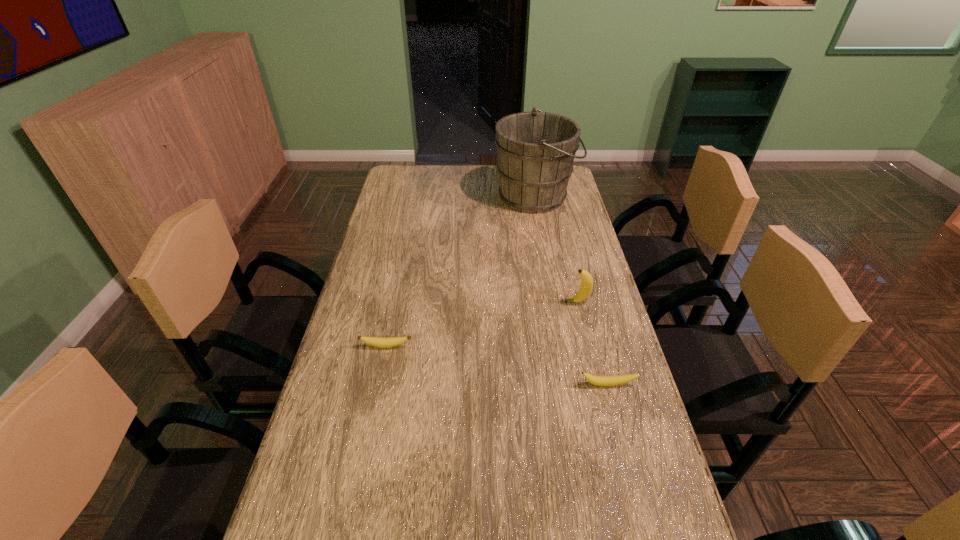
Where is `free space located from the stem of the farthest banana`? The width and height of the screenshot is (960, 540). free space located from the stem of the farthest banana is located at coordinates pyautogui.click(x=484, y=302).

I want to click on vacant space situated 0.150m on the upward curve of the second shortest object, so click(624, 446).

Identify the location of free space located 0.360m on the front of the third farthest object. The height and width of the screenshot is (540, 960). (357, 487).

At what (x,y) coordinates should I click in order to perform the action: click on object that is positioned at the far edge. Please return your answer as a coordinate pair (x, y). Image resolution: width=960 pixels, height=540 pixels. Looking at the image, I should click on (536, 150).

I want to click on object that is at the left edge, so click(x=381, y=342).

This screenshot has height=540, width=960. Identify the location of bucket located in the right edge section of the desktop. (536, 150).

The height and width of the screenshot is (540, 960). I want to click on object at the far right corner, so click(536, 150).

This screenshot has width=960, height=540. I want to click on free space at the far edge, so click(x=481, y=165).

At what (x,y) coordinates should I click in order to perform the action: click on vacant space at the left edge. Please return your answer as a coordinate pair (x, y). Looking at the image, I should click on (368, 258).

This screenshot has height=540, width=960. I want to click on vacant space at the right edge of the desktop, so click(x=589, y=309).